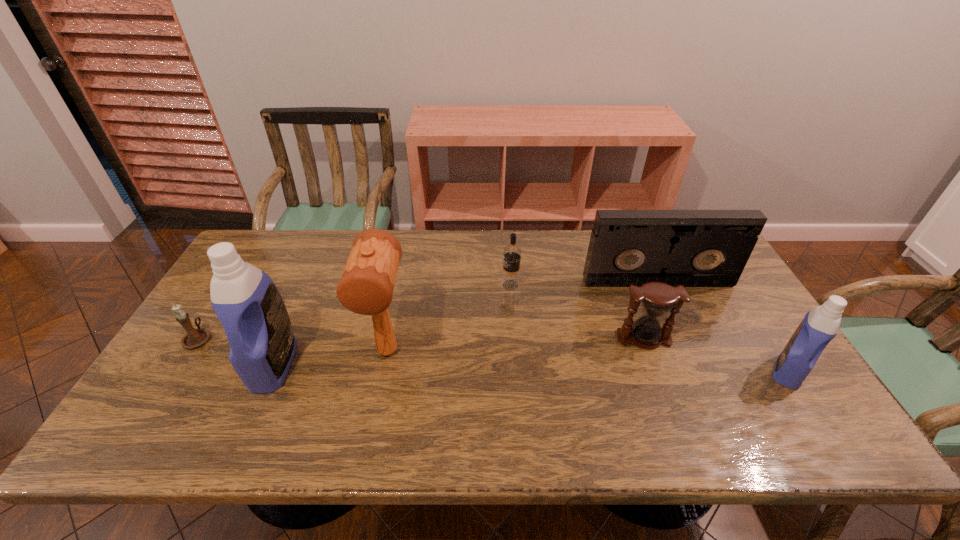
Where is `mallet positioned at the near edge`? This screenshot has width=960, height=540. mallet positioned at the near edge is located at coordinates (366, 287).

Where is `object that is at the left edge`? This screenshot has width=960, height=540. object that is at the left edge is located at coordinates (194, 338).

Locate an element on the screen. This screenshot has height=540, width=960. detergent located in the right edge section of the desktop is located at coordinates (820, 325).

Image resolution: width=960 pixels, height=540 pixels. In order to click on videotape present at the right edge in this screenshot , I will do `click(695, 248)`.

Find the location of a particular element. This screenshot has width=960, height=540. object at the near right corner is located at coordinates (820, 325).

In the image, there is a desktop. Where is `free region at the far edge`? Image resolution: width=960 pixels, height=540 pixels. free region at the far edge is located at coordinates (477, 235).

At what (x,y) coordinates should I click in order to perform the action: click on free location at the near edge of the desktop. Please return your answer as a coordinate pair (x, y). The height and width of the screenshot is (540, 960). Looking at the image, I should click on point(398,400).

Image resolution: width=960 pixels, height=540 pixels. I want to click on free space at the right edge of the desktop, so click(x=758, y=340).

Locate an element on the screen. The image size is (960, 540). blank space at the near left corner of the desktop is located at coordinates (179, 411).

I want to click on free space between the vodka and the hourglass, so click(577, 312).